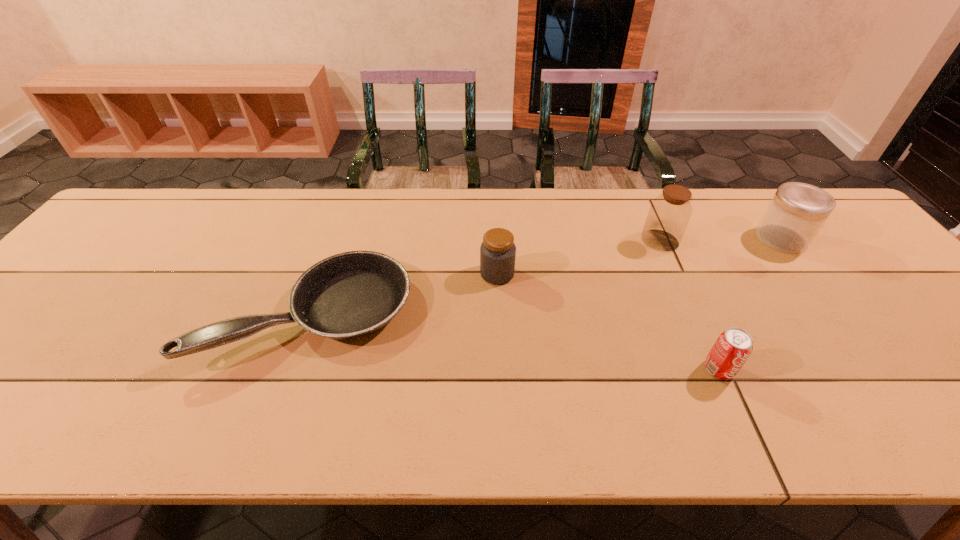
Locate an element on the screen. This screenshot has width=960, height=540. vacant area at the far left corner of the desktop is located at coordinates (154, 198).

Locate an element on the screen. The width and height of the screenshot is (960, 540). vacant area between the leftmost object and the rightmost jar is located at coordinates (545, 276).

At what (x,y) coordinates should I click in order to perform the action: click on unoccupied area between the second jar from right to left and the soda. Please return your answer as a coordinate pair (x, y). Looking at the image, I should click on (689, 305).

Find the location of a particular element. The height and width of the screenshot is (540, 960). free space that is in between the rightmost object and the fourth object from right to left is located at coordinates (639, 256).

Where is `free spot between the rightmost jar and the soda`? This screenshot has width=960, height=540. free spot between the rightmost jar and the soda is located at coordinates (750, 304).

Identify the location of unoccupied position between the soda and the rightmost jar. (750, 304).

The height and width of the screenshot is (540, 960). Identify the location of vacant area that lies between the leftmost object and the second shortest object. (515, 342).

Find the location of a particular element. free space between the shortest object and the second shortest object is located at coordinates (515, 342).

What are the coordinates of `vacant space in between the rightmost object and the second shortest object` in the screenshot? It's located at (750, 304).

Locate an element on the screen. object that is the closest one to the rightmost object is located at coordinates (669, 213).